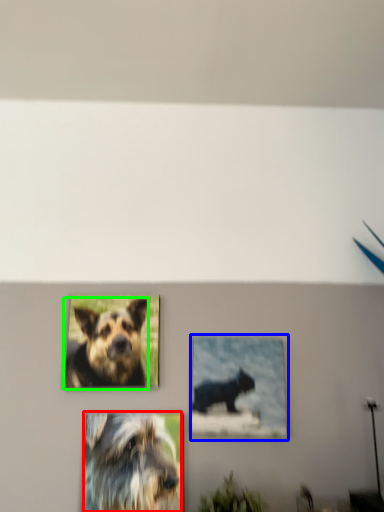
Question: Considering the real-world distances, which object is farthest from dog (highlighted by a red box)? picture frame (highlighted by a blue box) or dog (highlighted by a green box)?

Choices:
 (A) picture frame
 (B) dog

Answer: (A)